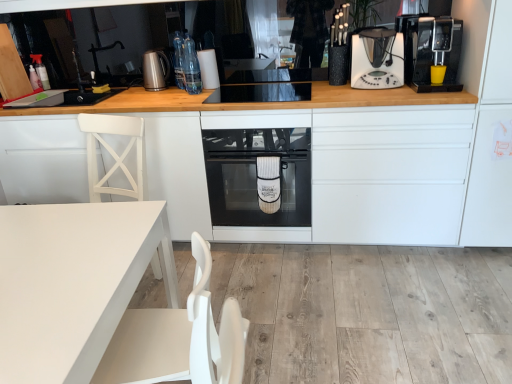
Question: Considering the relative sizes of black plastic coffee machine at right and clear glass bottles at upper center, placed as the 1th bottle when sorted from front to back, in the image provided, is black plastic coffee machine at right smaller than clear glass bottles at upper center, placed as the 1th bottle when sorted from front to back,?

Choices:
 (A) yes
 (B) no

Answer: (B)

Question: Considering the relative sizes of black plastic coffee machine at right and clear glass bottles at upper center, placed as the 2th bottle when sorted from back to front, in the image provided, is black plastic coffee machine at right taller than clear glass bottles at upper center, placed as the 2th bottle when sorted from back to front,?

Choices:
 (A) yes
 (B) no

Answer: (A)

Question: Does black plastic coffee machine at right come in front of clear glass bottles at upper center, placed as the 2th bottle when sorted from back to front?

Choices:
 (A) no
 (B) yes

Answer: (B)

Question: From a real-world perspective, is black plastic coffee machine at right on top of clear glass bottles at upper center, placed as the 2th bottle when sorted from back to front?

Choices:
 (A) no
 (B) yes

Answer: (A)

Question: Can you confirm if black plastic coffee machine at right is bigger than clear glass bottles at upper center, placed as the 1th bottle when sorted from front to back?

Choices:
 (A) no
 (B) yes

Answer: (B)

Question: Considering the positions of white matte table at lower left, the 2th cabinetry positioned from the right, and black plastic coffee machine at right in the image, is white matte table at lower left, the 2th cabinetry positioned from the right, wider or thinner than black plastic coffee machine at right?

Choices:
 (A) wide
 (B) thin

Answer: (B)

Question: From a real-world perspective, is white matte table at lower left, the 2th cabinetry positioned from the right, positioned above or below black plastic coffee machine at right?

Choices:
 (A) above
 (B) below

Answer: (B)

Question: Is point (173, 135) closer or farther from the camera than point (480, 102)?

Choices:
 (A) closer
 (B) farther

Answer: (B)

Question: From the image's perspective, is white matte table at lower left, the 1th cabinetry viewed from the left, located above or below black plastic coffee machine at right?

Choices:
 (A) below
 (B) above

Answer: (A)

Question: From a real-world perspective, is black glass oven at center physically located above or below brushed metal kettle at upper center, which is counted as the third kitchen appliance, starting from the right?

Choices:
 (A) below
 (B) above

Answer: (A)

Question: Considering the relative positions of black glass oven at center and brushed metal kettle at upper center, which is counted as the third kitchen appliance, starting from the right, in the image provided, is black glass oven at center to the left or to the right of brushed metal kettle at upper center, which is counted as the third kitchen appliance, starting from the right,?

Choices:
 (A) right
 (B) left

Answer: (A)

Question: In the image, is black glass oven at center positioned in front of or behind brushed metal kettle at upper center, which is the first kitchen appliance from left to right?

Choices:
 (A) behind
 (B) front

Answer: (B)

Question: Is point (294, 158) positioned closer to the camera than point (164, 66)?

Choices:
 (A) closer
 (B) farther

Answer: (A)

Question: Is brushed metal kettle at upper center, which is counted as the third kitchen appliance, starting from the right, wider or thinner than black plastic coffee machine at upper right, the 1th kitchen appliance viewed from the right?

Choices:
 (A) wide
 (B) thin

Answer: (B)

Question: Which is correct: brushed metal kettle at upper center, which is counted as the third kitchen appliance, starting from the right, is inside black plastic coffee machine at upper right, the 1th kitchen appliance viewed from the right, or outside of it?

Choices:
 (A) inside
 (B) outside

Answer: (B)